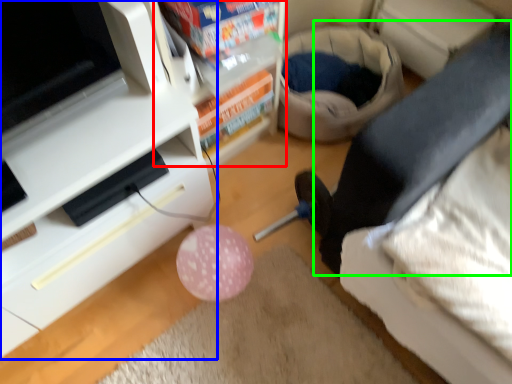
Question: Which object is positioned farthest from shelf (highlighted by a red box)? Select from furniture (highlighted by a blue box) and leg (highlighted by a green box).

Choices:
 (A) furniture
 (B) leg

Answer: (B)